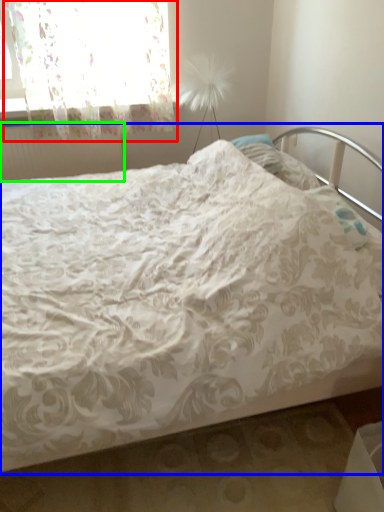
Question: Which is farther away from curtain (highlighted by a red box)? bed (highlighted by a blue box) or radiator (highlighted by a green box)?

Choices:
 (A) bed
 (B) radiator

Answer: (A)